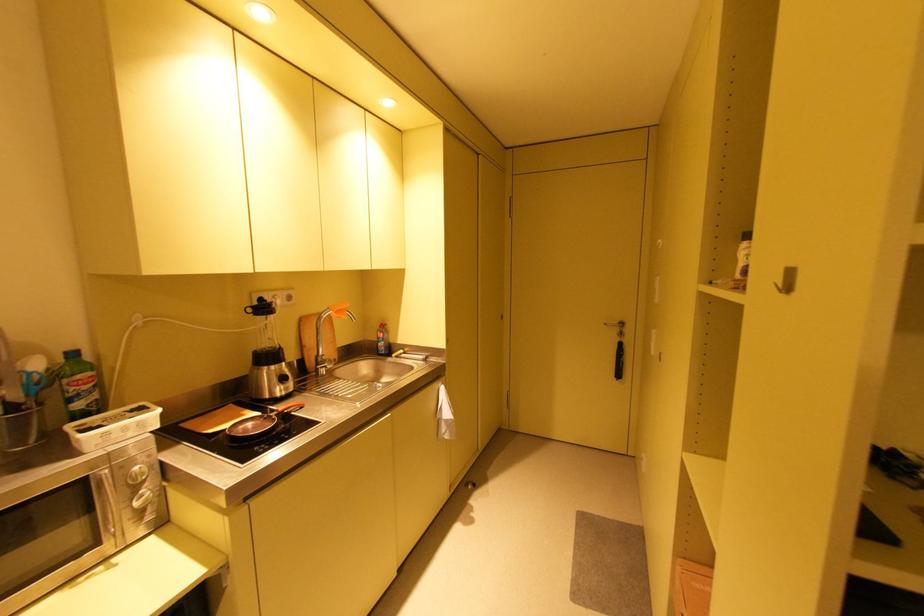
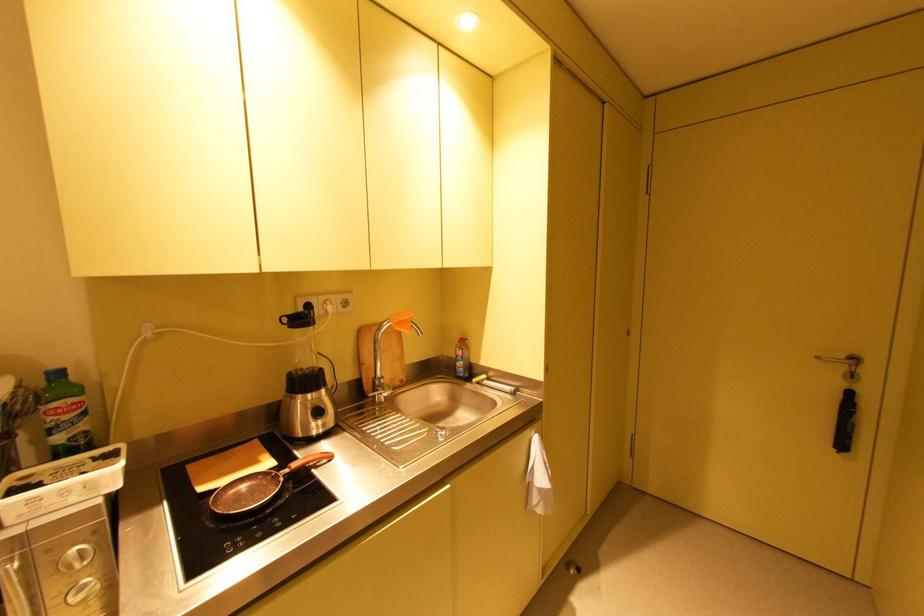
Question: The images are taken continuously from a first-person perspective. In which direction are you moving?

Choices:
 (A) Left
 (B) Right
 (C) Forward
 (D) Backward

Answer: (C)